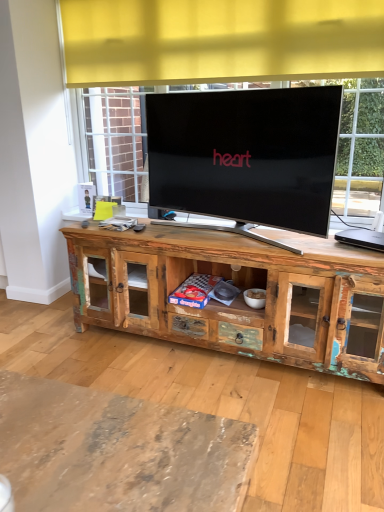
The image size is (384, 512). What do you see at coordinates (360, 236) in the screenshot?
I see `black plastic laptop at right` at bounding box center [360, 236].

Locate an element on the screen. black plastic laptop at right is located at coordinates (360, 236).

The image size is (384, 512). In order to click on rustic wood cabinet at center in this screenshot , I will do `click(239, 295)`.

In order to face rustic wood cabinet at center, should I rotate leftwards or rightwards?

It's best to rotate right around 3.669 degrees.

Image resolution: width=384 pixels, height=512 pixels. Describe the element at coordinates (239, 295) in the screenshot. I see `rustic wood cabinet at center` at that location.

I want to click on black plastic laptop at right, so click(360, 236).

Between black plastic laptop at right and rustic wood cabinet at center, which one appears on the left side from the viewer's perspective?

rustic wood cabinet at center.

Is black plastic laptop at right in front of or behind rustic wood cabinet at center in the image?

black plastic laptop at right is positioned farther from the viewer than rustic wood cabinet at center.

Is point (349, 230) closer or farther from the camera than point (148, 255)?

Point (349, 230).

From the image's perspective, is black plastic laptop at right positioned above or below rustic wood cabinet at center?

Clearly, from the image's perspective, black plastic laptop at right is above rustic wood cabinet at center.

From a real-world perspective, is black plastic laptop at right under rustic wood cabinet at center?

Actually, black plastic laptop at right is physically above rustic wood cabinet at center in the real world.

Between black plastic laptop at right and rustic wood cabinet at center, which one has smaller width?

black plastic laptop at right is thinner.

Is black plastic laptop at right taller than rustic wood cabinet at center?

No, black plastic laptop at right is not taller than rustic wood cabinet at center.

Considering the sizes of objects black plastic laptop at right and rustic wood cabinet at center in the image provided, who is bigger, black plastic laptop at right or rustic wood cabinet at center?

Bigger between the two is rustic wood cabinet at center.

Is black plastic laptop at right located outside rustic wood cabinet at center?

Yes, black plastic laptop at right is not within rustic wood cabinet at center.

Is there a large distance between black plastic laptop at right and rustic wood cabinet at center?

No, black plastic laptop at right is not far from rustic wood cabinet at center.

Is black plastic laptop at right facing away from rustic wood cabinet at center?

No, rustic wood cabinet at center is not at the back of black plastic laptop at right.

The height and width of the screenshot is (512, 384). Identify the location of cabinetry to the left of black plastic laptop at right. (239, 295).

Does rustic wood cabinet at center appear on the right side of black plastic laptop at right?

Incorrect, rustic wood cabinet at center is not on the right side of black plastic laptop at right.

Does rustic wood cabinet at center lie behind black plastic laptop at right?

No, it is in front of black plastic laptop at right.

In the scene shown: Which is closer, (192, 329) or (347, 237)?

Clearly, point (192, 329) is more distant from the camera than point (347, 237).

From the image's perspective, relative to black plastic laptop at right, is rustic wood cabinet at center above or below?

rustic wood cabinet at center is situated lower than black plastic laptop at right in the image.

From a real-world perspective, is rustic wood cabinet at center below black plastic laptop at right?

Yes.

Which of these two, rustic wood cabinet at center or black plastic laptop at right, is wider?

rustic wood cabinet at center.

Who is taller, rustic wood cabinet at center or black plastic laptop at right?

With more height is rustic wood cabinet at center.

Does rustic wood cabinet at center have a smaller size compared to black plastic laptop at right?

Incorrect, rustic wood cabinet at center is not smaller in size than black plastic laptop at right.

Does rustic wood cabinet at center contain black plastic laptop at right?

No, black plastic laptop at right is not inside rustic wood cabinet at center.

Is rustic wood cabinet at center next to black plastic laptop at right and touching it?

There is a gap between rustic wood cabinet at center and black plastic laptop at right.

Is rustic wood cabinet at center facing away from black plastic laptop at right?

No, black plastic laptop at right is not at the back of rustic wood cabinet at center.

The width and height of the screenshot is (384, 512). Identify the location of cabinetry lying below the black plastic laptop at right (from the image's perspective). (239, 295).

You are a GUI agent. You are given a task and a screenshot of the screen. Output one action in this format:
    pyautogui.click(x=<x>, y=<y>)
    Task: Click on the cabinetry in front of the black plastic laptop at right
    
    Given the screenshot: What is the action you would take?
    pyautogui.click(x=239, y=295)

The image size is (384, 512). Find the location of `computer on the right of rustic wood cabinet at center`. computer on the right of rustic wood cabinet at center is located at coordinates (360, 236).